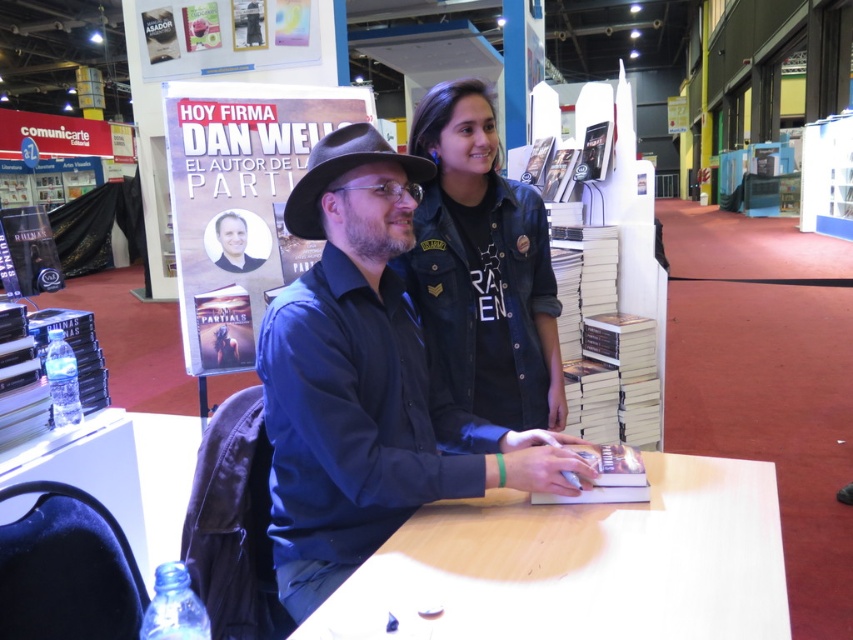
You are at the event and want to grab your water bottle without moving from your current spot. Can you reach the clear plastic water bottle at lower left from where you are standing near the light wood table at center?

The light wood table at center is closer to the viewer than the clear plastic water bottle at lower left, so you can reach the clear plastic water bottle at lower left from where you are standing near the light wood table at center.

You are organizing a book signing event and need to ensure that the blue shirt at center and the denim jacket at center can fit on a display rack that has a maximum width of 1.2 meters. Based on their sizes, will both items fit on the rack together?

The blue shirt at center is bigger than the denim jacket at center, but since the total width of both items combined is not provided, it is impossible to determine if they will fit on the rack together.